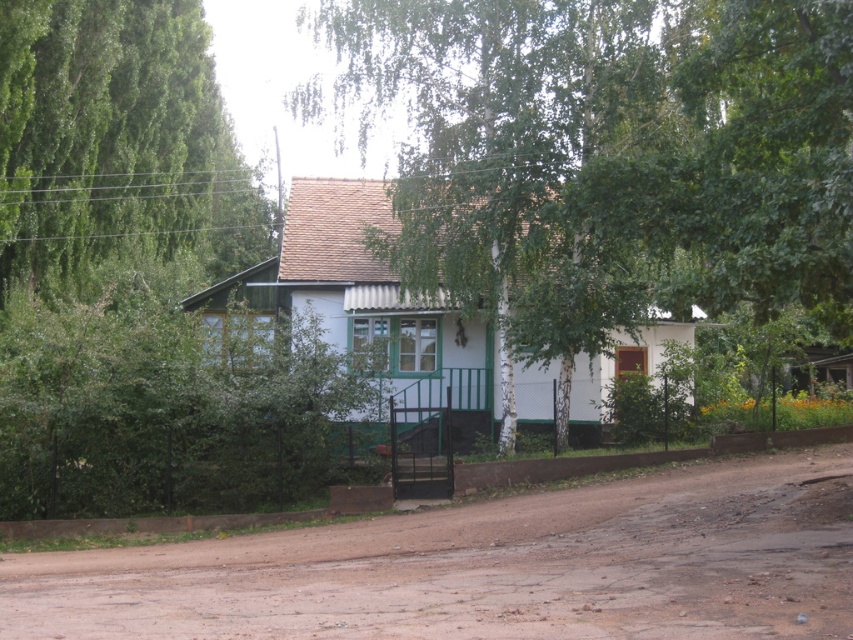
Can you confirm if green bark tree at center is positioned below brown dirt track at center?

Incorrect, green bark tree at center is not positioned below brown dirt track at center.

Is point (724, 4) positioned in front of point (320, 632)?

No, (724, 4) is further to viewer.

Is point (723, 52) positioned before point (635, 618)?

No, (723, 52) is further to viewer.

Locate an element on the screen. green bark tree at center is located at coordinates (610, 157).